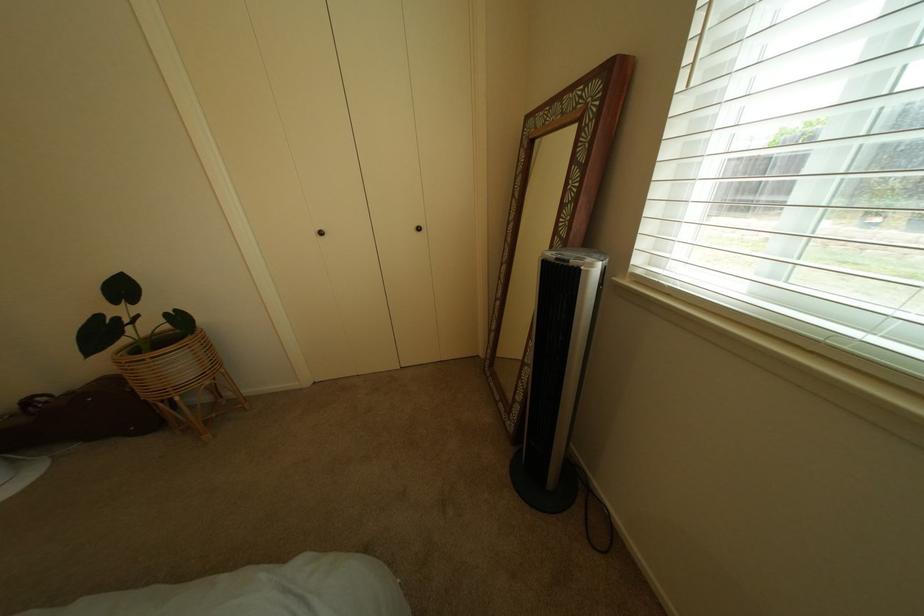
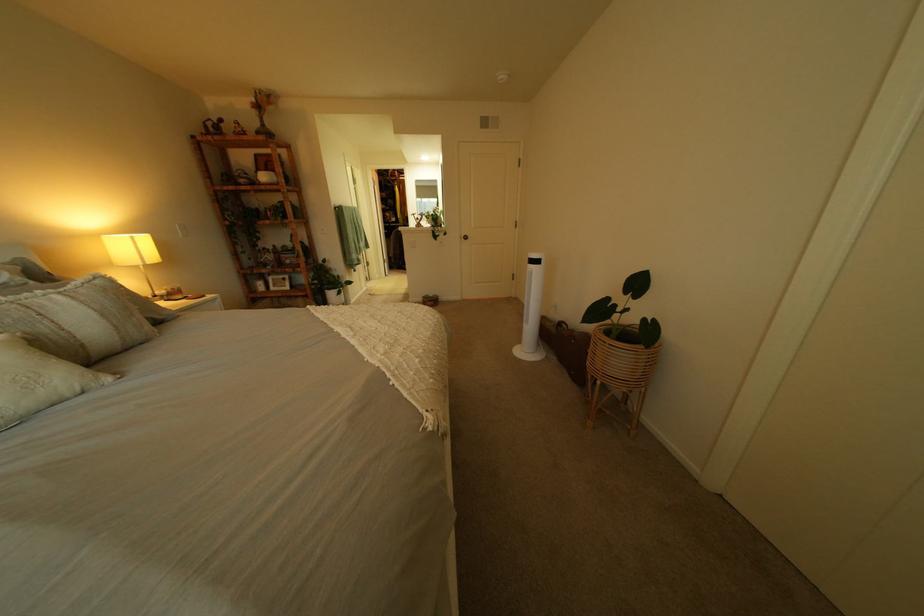
Based on the continuous images, in which direction is the camera rotating?

The camera rotated toward left-down.